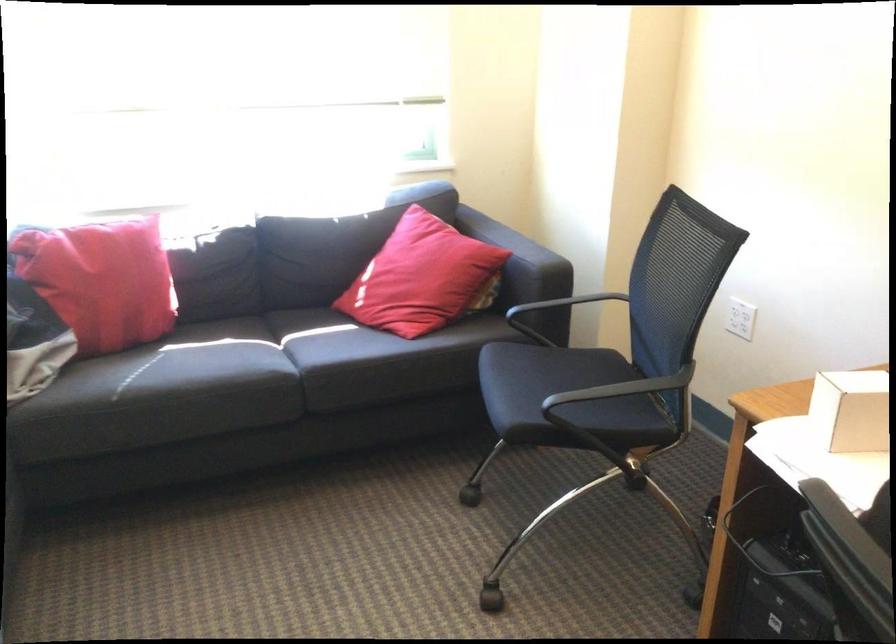
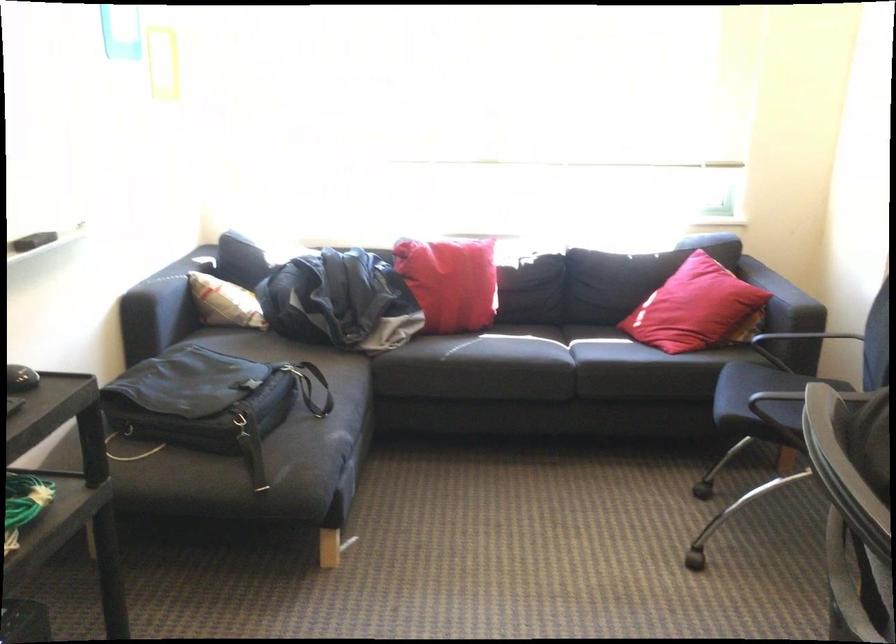
Where in the second image is the point corresponding to (x=246, y=386) from the first image?

(535, 364)